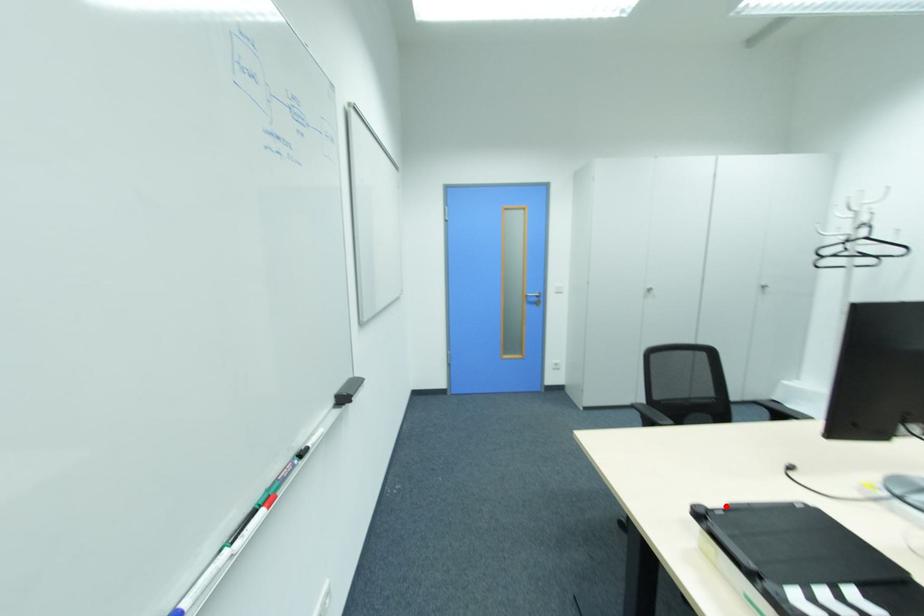
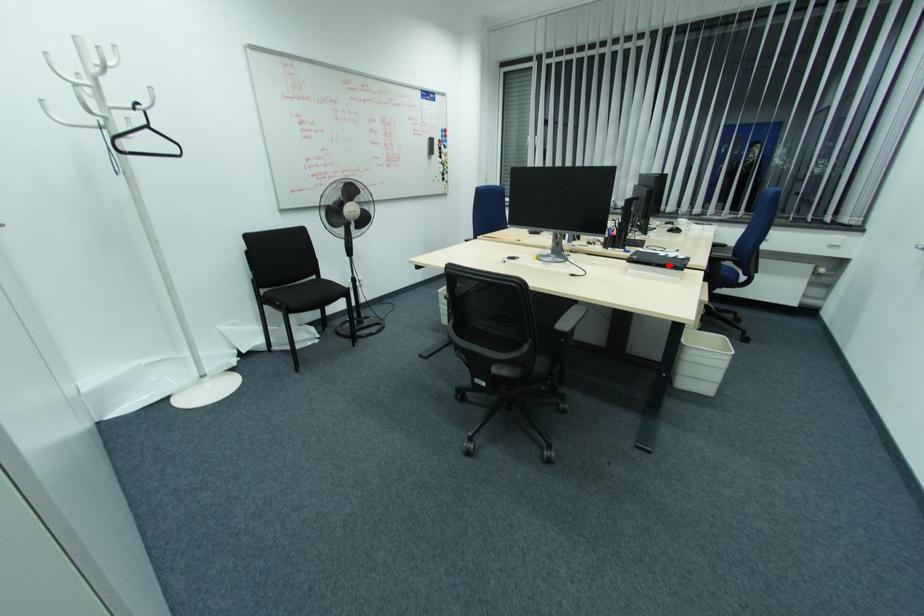
I am providing you with two images of the same scene from different viewpoints. A red point is marked on the first image and another point is marked on the second image. Does the point marked in image1 correspond to the same location as the one in image2?

Yes